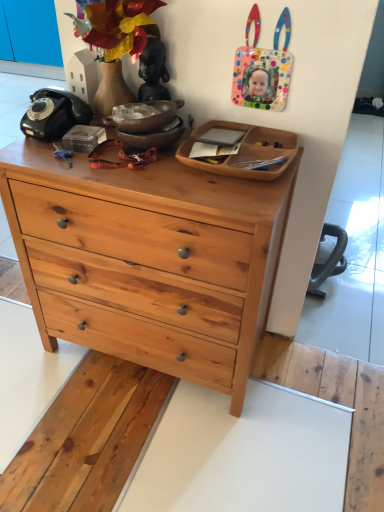
Question: From the image's perspective, is wooden tray at center positioned above or below natural wood chest of drawers at center?

Choices:
 (A) above
 (B) below

Answer: (A)

Question: From a real-world perspective, is wooden tray at center physically located above or below natural wood chest of drawers at center?

Choices:
 (A) above
 (B) below

Answer: (A)

Question: In the image, is wooden tray at center positioned in front of or behind natural wood chest of drawers at center?

Choices:
 (A) behind
 (B) front

Answer: (A)

Question: Considering the positions of natural wood chest of drawers at center and wooden tray at center in the image, is natural wood chest of drawers at center taller or shorter than wooden tray at center?

Choices:
 (A) tall
 (B) short

Answer: (A)

Question: Considering the positions of natural wood chest of drawers at center and wooden tray at center in the image, is natural wood chest of drawers at center wider or thinner than wooden tray at center?

Choices:
 (A) thin
 (B) wide

Answer: (B)

Question: Is natural wood chest of drawers at center inside or outside of wooden tray at center?

Choices:
 (A) outside
 (B) inside

Answer: (A)

Question: In the image, is natural wood chest of drawers at center positioned in front of or behind wooden tray at center?

Choices:
 (A) front
 (B) behind

Answer: (A)